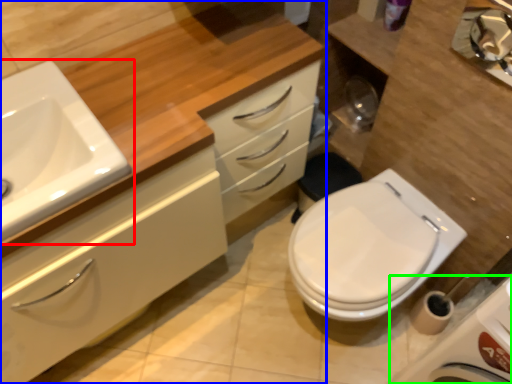
Question: Which object is the closest to the sink (highlighted by a red box)? Choose among these: bathroom cabinet (highlighted by a blue box) or porcelain (highlighted by a green box).

Choices:
 (A) bathroom cabinet
 (B) porcelain

Answer: (A)